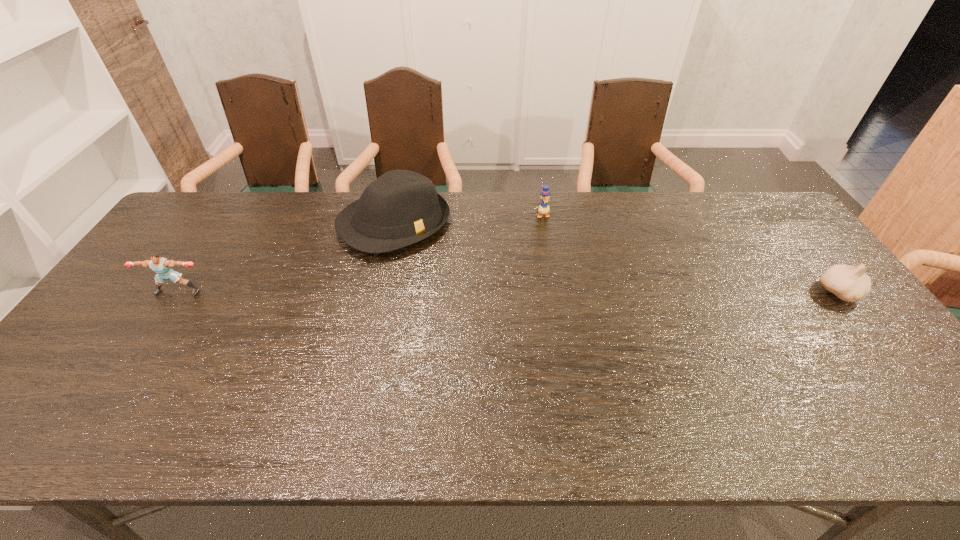
In the image, there is a desktop. Where is `vacant area at the near right corner`? This screenshot has height=540, width=960. vacant area at the near right corner is located at coordinates (852, 371).

Find the location of a particular element. The height and width of the screenshot is (540, 960). empty space that is in between the fedora and the puncher is located at coordinates (286, 258).

Locate an element on the screen. This screenshot has width=960, height=540. unoccupied position between the duckling and the second object from left to right is located at coordinates (468, 219).

Identify the location of free point between the fedora and the puncher. The height and width of the screenshot is (540, 960). (286, 258).

Identify the location of free space between the puncher and the second object from left to right. [286, 258].

Identify the location of empty space that is in between the leftmost object and the third object from right to left. (286, 258).

The width and height of the screenshot is (960, 540). What are the coordinates of `empty space that is in between the duckling and the rightmost object` in the screenshot? It's located at (690, 254).

This screenshot has height=540, width=960. I want to click on unoccupied position between the fedora and the leftmost object, so click(286, 258).

Find the location of a particular element. The width and height of the screenshot is (960, 540). empty location between the garlic and the duckling is located at coordinates click(690, 254).

Find the location of a particular element. This screenshot has width=960, height=540. empty space that is in between the leftmost object and the fedora is located at coordinates (286, 258).